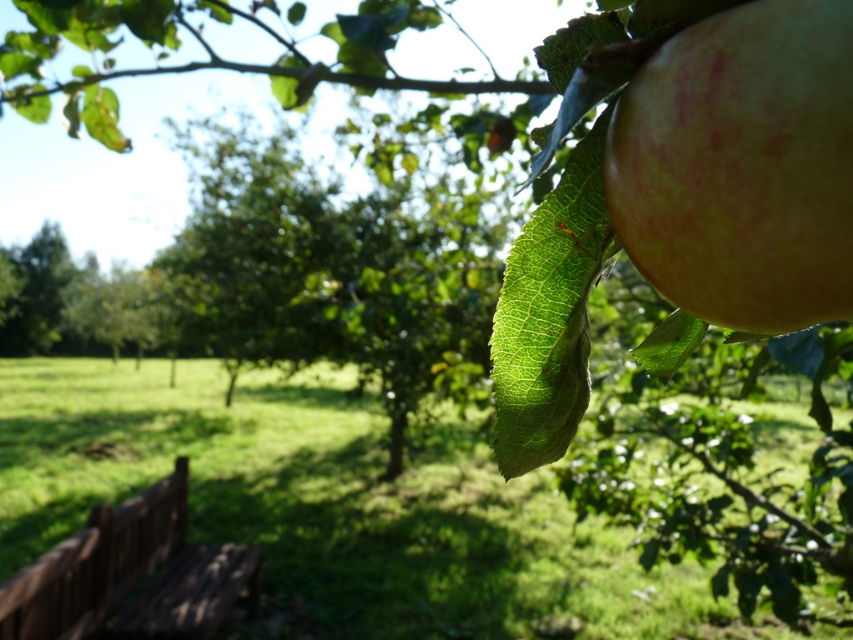
Question: Is ripe yellow-green apple at upper right smaller than brown wooden bench at lower left?

Choices:
 (A) no
 (B) yes

Answer: (B)

Question: Does ripe yellow-green apple at upper right have a greater width compared to brown wooden bench at lower left?

Choices:
 (A) yes
 (B) no

Answer: (B)

Question: Which point is closer to the camera?

Choices:
 (A) ripe yellow-green apple at upper right
 (B) brown wooden bench at lower left

Answer: (A)

Question: Does ripe yellow-green apple at upper right appear on the left side of brown wooden bench at lower left?

Choices:
 (A) no
 (B) yes

Answer: (A)

Question: Which point is farther to the camera?

Choices:
 (A) (68, 600)
 (B) (683, 205)

Answer: (A)